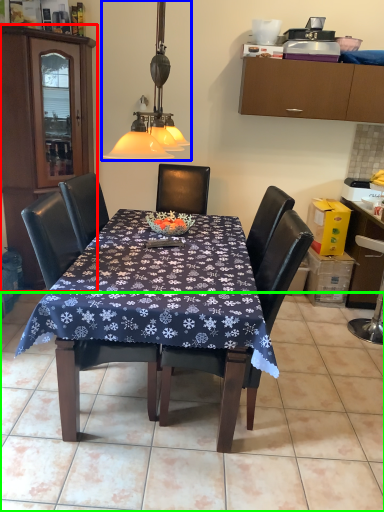
Question: Which object is positioned closest to cabinetry (highlighted by a red box)? Select from lamp (highlighted by a blue box) and tile (highlighted by a green box).

Choices:
 (A) lamp
 (B) tile

Answer: (A)